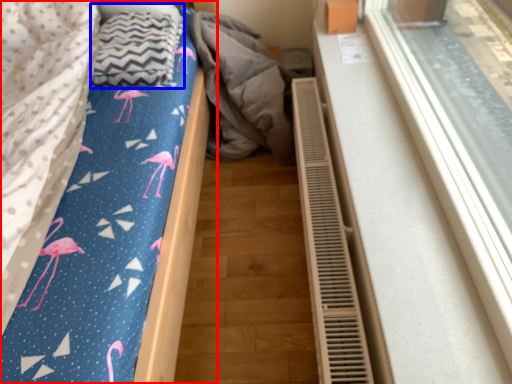
Question: Among these objects, which one is farthest to the camera, bed (highlighted by a red box) or blanket (highlighted by a blue box)?

Choices:
 (A) bed
 (B) blanket

Answer: (B)